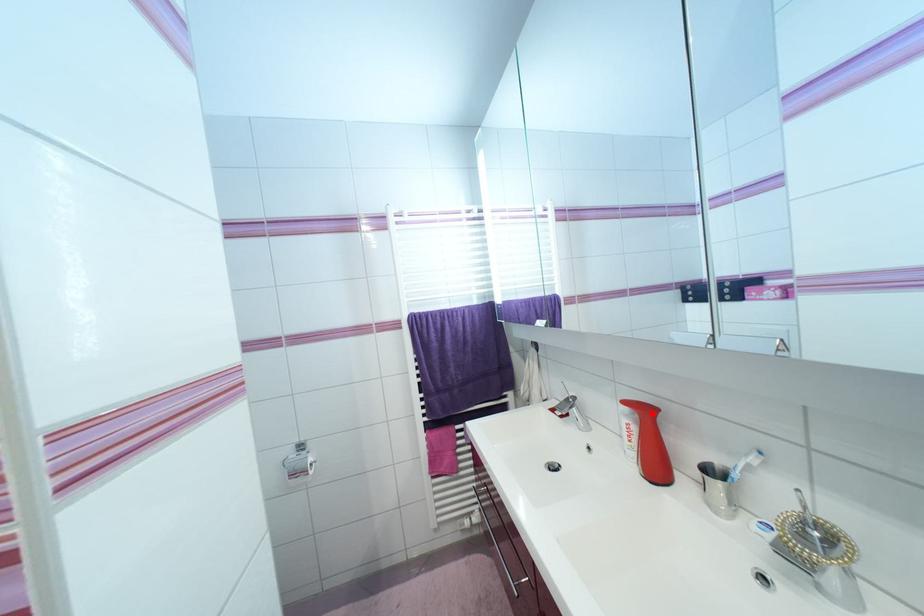
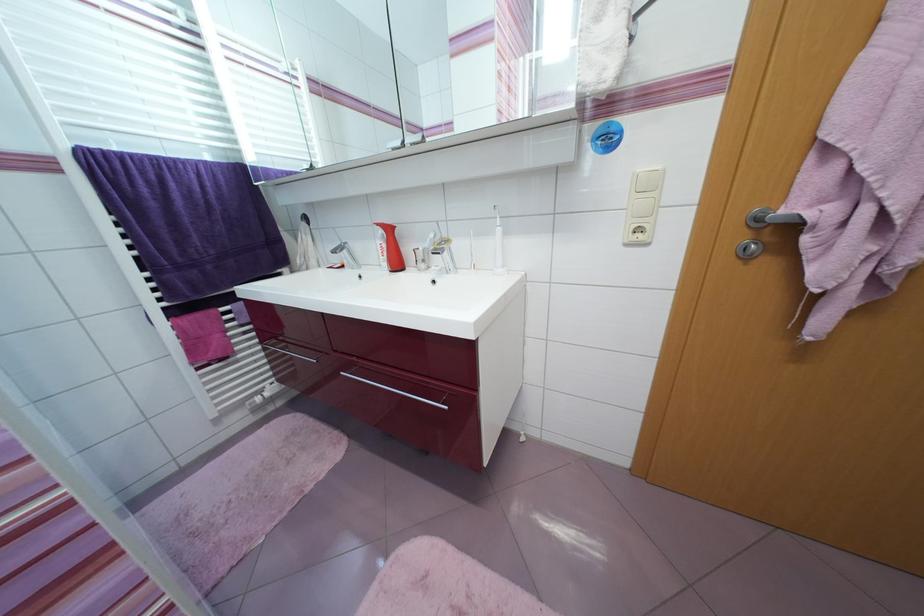
Where in the second image is the point corresponding to the highlighted location from the first image?

(394, 231)